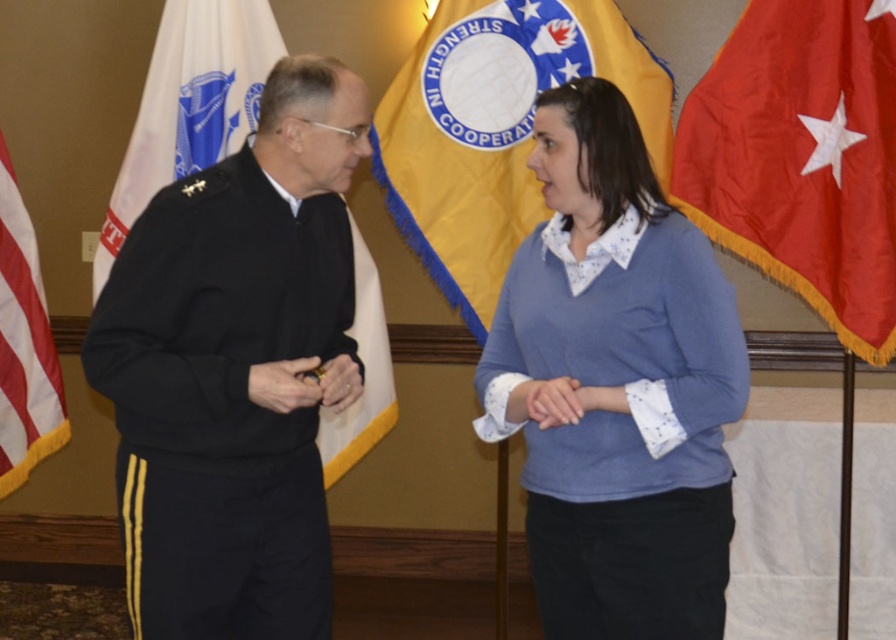
You are standing at the origin point of the image. Which of the two points, point (849, 100) or point (613, 16), is closer to you?

Point (849, 100) is closer to you because it is in front of point (613, 16).

In the scene shown: You are standing at the center of the image and want to move towards the red fabric flag at right. Which direction should you face to walk straight towards it?

The red fabric flag at right is located at point 0.247 on the x axis and 0.896 on the y axis. Since you are at the center, facing towards the right side of the image would align you with the flag.